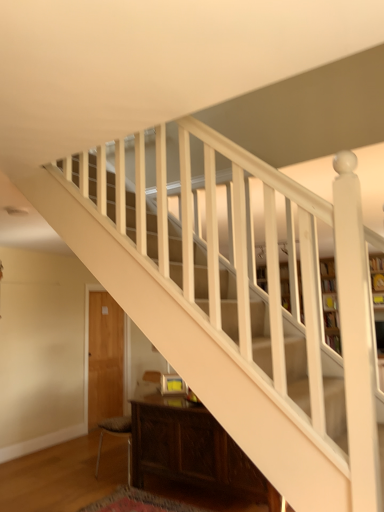
Question: Does dark wood cabinet at lower center lie behind white wood bookcase at center?

Choices:
 (A) yes
 (B) no

Answer: (B)

Question: From a real-world perspective, is dark wood cabinet at lower center on white wood bookcase at center?

Choices:
 (A) no
 (B) yes

Answer: (A)

Question: Is dark wood cabinet at lower center aimed at white wood bookcase at center?

Choices:
 (A) yes
 (B) no

Answer: (B)

Question: Is dark wood cabinet at lower center to the right of white wood bookcase at center from the viewer's perspective?

Choices:
 (A) no
 (B) yes

Answer: (A)

Question: Is dark wood cabinet at lower center positioned beyond the bounds of white wood bookcase at center?

Choices:
 (A) no
 (B) yes

Answer: (B)

Question: From a real-world perspective, is dark brown leather armchair at lower left positioned above or below dark wood cabinet at lower center?

Choices:
 (A) above
 (B) below

Answer: (A)

Question: Looking at the image, does dark brown leather armchair at lower left seem bigger or smaller compared to dark wood cabinet at lower center?

Choices:
 (A) big
 (B) small

Answer: (B)

Question: Looking at their shapes, would you say dark brown leather armchair at lower left is wider or thinner than dark wood cabinet at lower center?

Choices:
 (A) wide
 (B) thin

Answer: (A)

Question: From their relative heights in the image, would you say dark brown leather armchair at lower left is taller or shorter than dark wood cabinet at lower center?

Choices:
 (A) short
 (B) tall

Answer: (B)

Question: Is white wood bookcase at center inside or outside of dark wood cabinet at lower center?

Choices:
 (A) outside
 (B) inside

Answer: (A)

Question: Considering the positions of white wood bookcase at center and dark wood cabinet at lower center in the image, is white wood bookcase at center wider or thinner than dark wood cabinet at lower center?

Choices:
 (A) thin
 (B) wide

Answer: (A)

Question: From a real-world perspective, is white wood bookcase at center above or below dark wood cabinet at lower center?

Choices:
 (A) above
 (B) below

Answer: (A)

Question: Looking at the image, does white wood bookcase at center seem bigger or smaller compared to dark wood cabinet at lower center?

Choices:
 (A) big
 (B) small

Answer: (A)

Question: Looking at their shapes, would you say dark brown leather armchair at lower left is wider or thinner than white wood bookcase at center?

Choices:
 (A) thin
 (B) wide

Answer: (B)

Question: Is dark brown leather armchair at lower left in front of or behind white wood bookcase at center in the image?

Choices:
 (A) behind
 (B) front

Answer: (B)